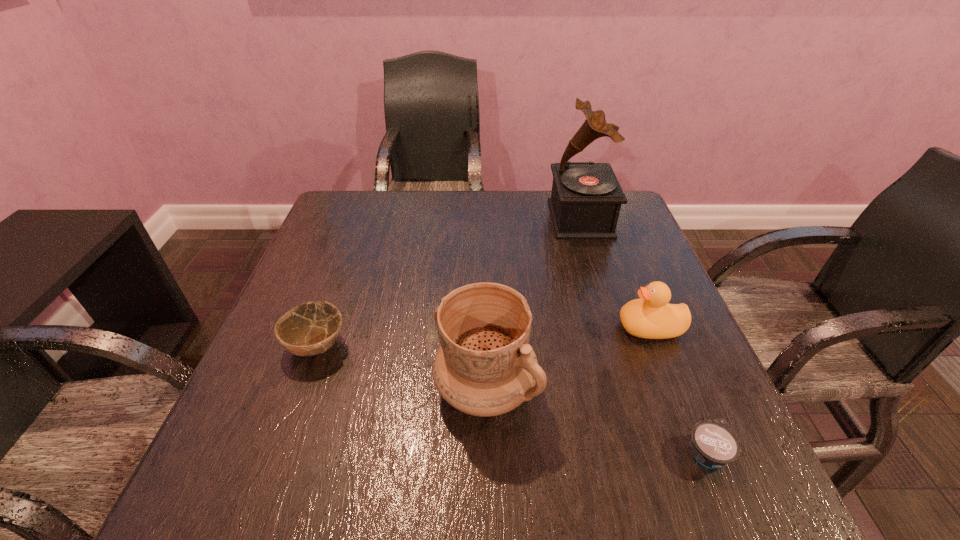
Locate an element on the screen. The height and width of the screenshot is (540, 960). vacant space located 0.130m at the horn opening of the phonograph_record is located at coordinates (504, 219).

The height and width of the screenshot is (540, 960). I want to click on vacant point located on the right of the fourth shortest object, so click(662, 388).

Find the location of a particular element. The width and height of the screenshot is (960, 540). vacant space located on the face of the duck is located at coordinates (575, 328).

The height and width of the screenshot is (540, 960). I want to click on free space located 0.390m on the face of the duck, so click(431, 328).

You are a GUI agent. You are given a task and a screenshot of the screen. Output one action in this format:
    pyautogui.click(x=<x>, y=<y>)
    Task: Click on the vacant space located 0.260m on the face of the duck
    This screenshot has height=540, width=960.
    Given the screenshot: What is the action you would take?
    pyautogui.click(x=493, y=328)

I want to click on free location located 0.200m on the front of the bowl, so click(x=270, y=475).

Identify the location of vacant area situated on the back of the yogurt. tap(664, 348).

The image size is (960, 540). I want to click on object that is positioned at the far edge, so click(x=586, y=198).

Locate an element on the screen. The height and width of the screenshot is (540, 960). object at the near edge is located at coordinates (713, 444).

At what (x,y) coordinates should I click in order to perform the action: click on object located in the left edge section of the desktop. Please return your answer as a coordinate pair (x, y). Looking at the image, I should click on (308, 329).